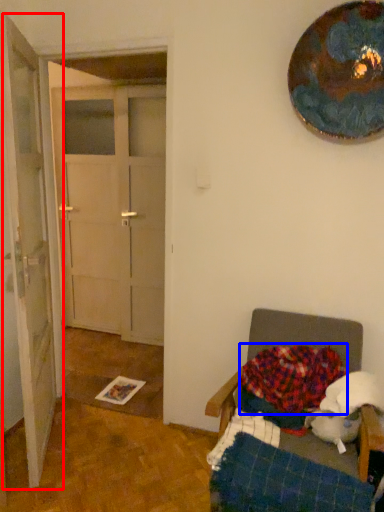
Question: Among these objects, which one is farthest to the camera, door (highlighted by a red box) or blanket (highlighted by a blue box)?

Choices:
 (A) door
 (B) blanket

Answer: (B)